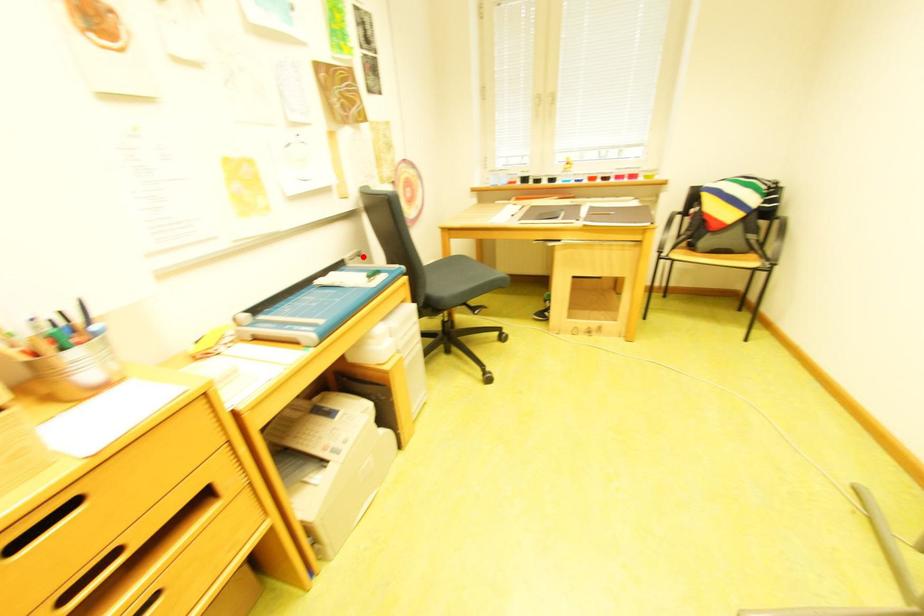
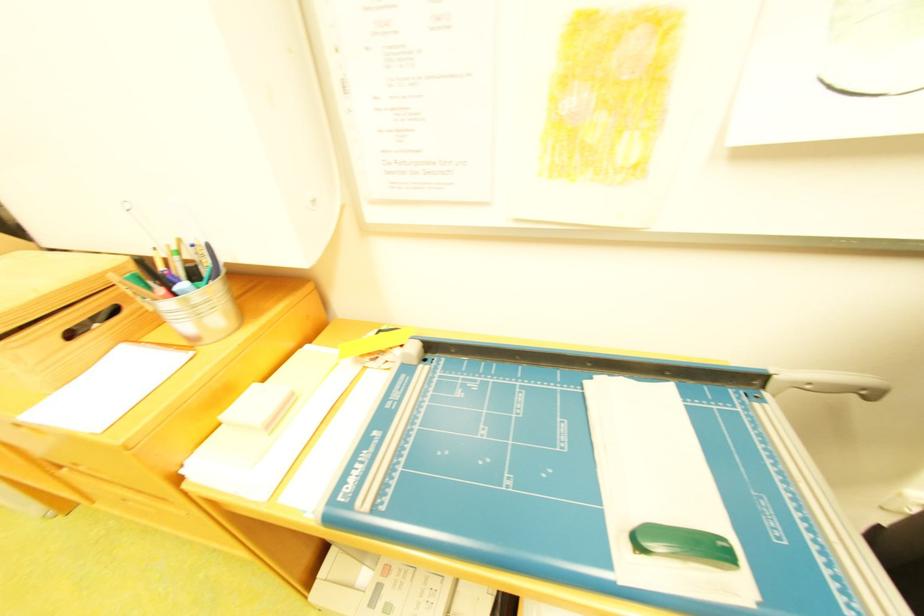
Where in the second image is the point corresponding to the highlighted location from the first image?

(821, 385)